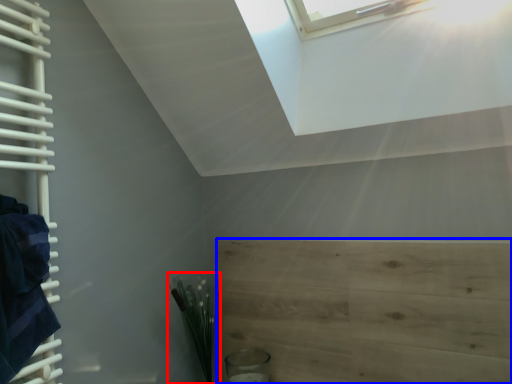
Question: Which of the following is the closest to the observer, plant (highlighted by a red box) or plywood (highlighted by a blue box)?

Choices:
 (A) plant
 (B) plywood

Answer: (B)